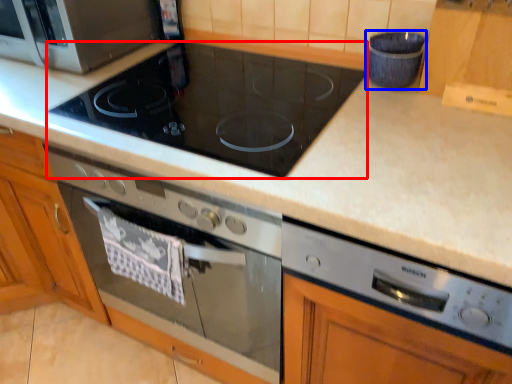
Question: Which of the following is the closest to the observer, gas stove (highlighted by a red box) or appliance (highlighted by a blue box)?

Choices:
 (A) gas stove
 (B) appliance

Answer: (A)